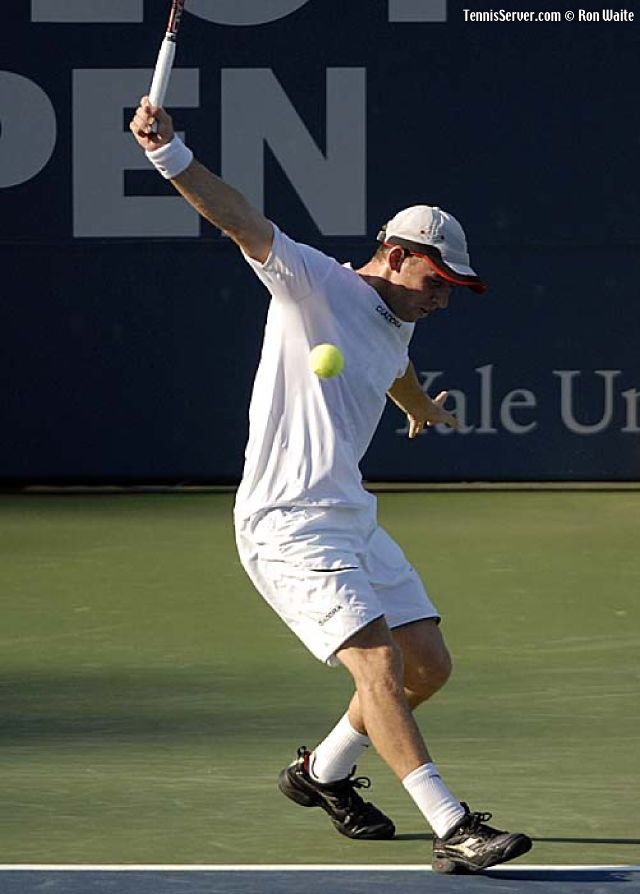
The image size is (640, 894). Identify the location of blue wall with white text on it. (509, 196).